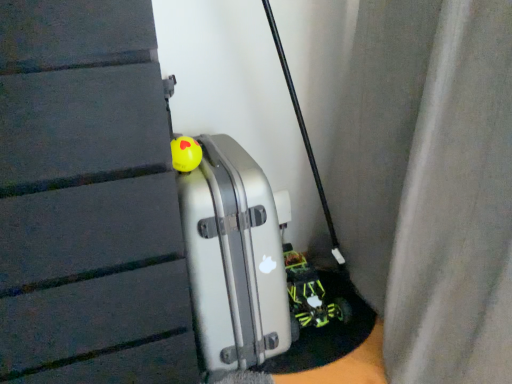
Question: Can you confirm if silver metallic suitcase at center is wider than neon green plastic toy car at lower right?

Choices:
 (A) no
 (B) yes

Answer: (B)

Question: Considering the relative sizes of silver metallic suitcase at center and neon green plastic toy car at lower right in the image provided, is silver metallic suitcase at center bigger than neon green plastic toy car at lower right?

Choices:
 (A) no
 (B) yes

Answer: (B)

Question: From a real-world perspective, is silver metallic suitcase at center positioned over neon green plastic toy car at lower right based on gravity?

Choices:
 (A) no
 (B) yes

Answer: (B)

Question: Is the depth of silver metallic suitcase at center less than that of neon green plastic toy car at lower right?

Choices:
 (A) yes
 (B) no

Answer: (A)

Question: Would you say silver metallic suitcase at center is outside neon green plastic toy car at lower right?

Choices:
 (A) no
 (B) yes

Answer: (B)

Question: Is the position of silver metallic suitcase at center more distant than that of neon green plastic toy car at lower right?

Choices:
 (A) no
 (B) yes

Answer: (A)

Question: Is silver metallic suitcase at center taller than yellow rubber ball at center?

Choices:
 (A) yes
 (B) no

Answer: (A)

Question: Can you confirm if silver metallic suitcase at center is positioned to the right of yellow rubber ball at center?

Choices:
 (A) yes
 (B) no

Answer: (A)

Question: Is silver metallic suitcase at center wider than yellow rubber ball at center?

Choices:
 (A) yes
 (B) no

Answer: (A)

Question: Considering the relative sizes of silver metallic suitcase at center and yellow rubber ball at center in the image provided, is silver metallic suitcase at center bigger than yellow rubber ball at center?

Choices:
 (A) no
 (B) yes

Answer: (B)

Question: Is silver metallic suitcase at center located outside yellow rubber ball at center?

Choices:
 (A) no
 (B) yes

Answer: (B)

Question: From the image's perspective, is silver metallic suitcase at center on top of yellow rubber ball at center?

Choices:
 (A) no
 (B) yes

Answer: (A)

Question: From the image's perspective, is neon green plastic toy car at lower right below silver metallic suitcase at center?

Choices:
 (A) yes
 (B) no

Answer: (A)